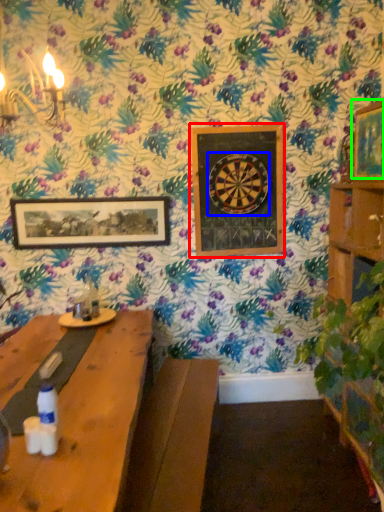
Question: Considering the real-world distances, which object is farthest from picture frame (highlighted by a red box)? design (highlighted by a blue box) or picture frame (highlighted by a green box)?

Choices:
 (A) design
 (B) picture frame

Answer: (B)